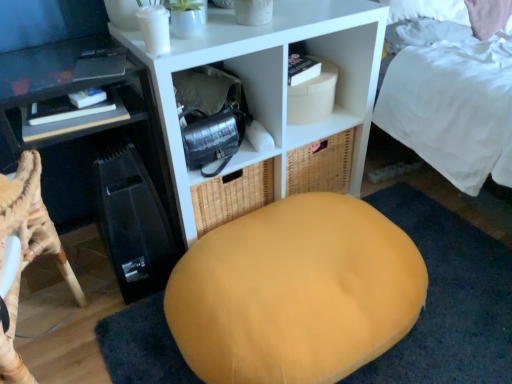
At what (x,y) coordinates should I click in order to perform the action: click on vacant space positioned to the left of black plastic shelf at left, the first shelf in the left-to-right sequence. Please return your answer as a coordinate pair (x, y). Image resolution: width=512 pixels, height=384 pixels. Looking at the image, I should click on (75, 272).